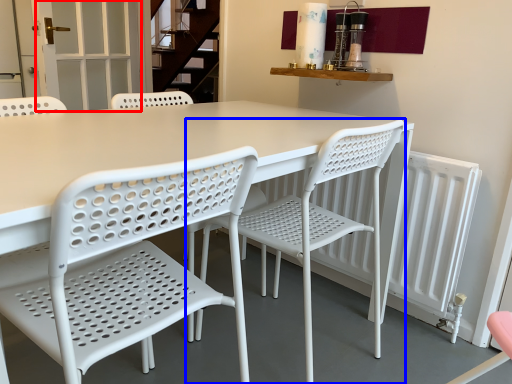
Question: Which object appears farthest to the camera in this image, screen door (highlighted by a red box) or chair (highlighted by a blue box)?

Choices:
 (A) screen door
 (B) chair

Answer: (A)